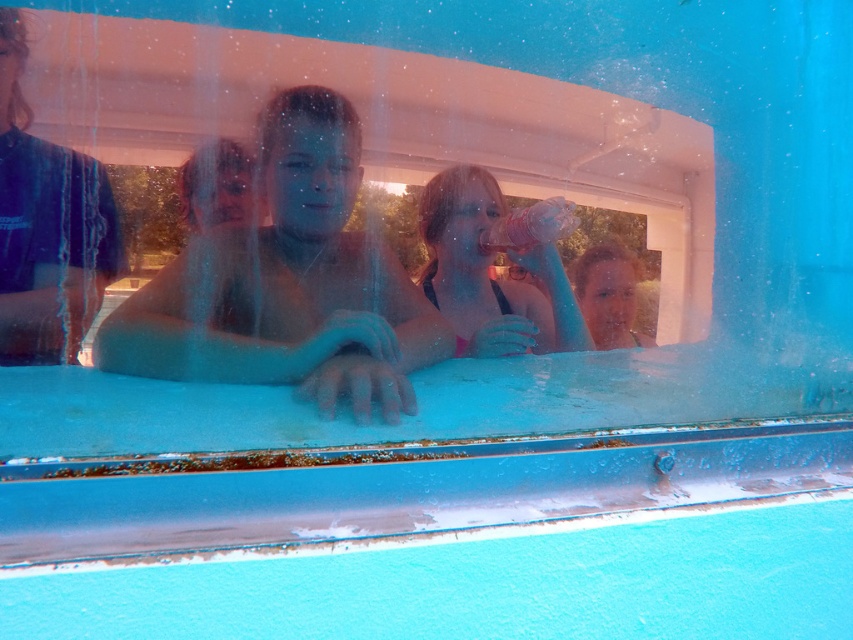
Question: Which of the following is the closest to the observer?

Choices:
 (A) smooth skin boy at center
 (B) pink fabric bikini top at center

Answer: (A)

Question: Considering the relative positions of smooth skin boy at center and pink fabric bikini top at center in the image provided, where is smooth skin boy at center located with respect to pink fabric bikini top at center?

Choices:
 (A) right
 (B) left

Answer: (B)

Question: Which object appears closest to the camera in this image?

Choices:
 (A) smooth skin boy at center
 (B) pink fabric bikini top at center

Answer: (A)

Question: Is smooth skin boy at center to the left of pink fabric bikini top at center from the viewer's perspective?

Choices:
 (A) no
 (B) yes

Answer: (B)

Question: Is smooth skin boy at center smaller than pink fabric bikini top at center?

Choices:
 (A) yes
 (B) no

Answer: (B)